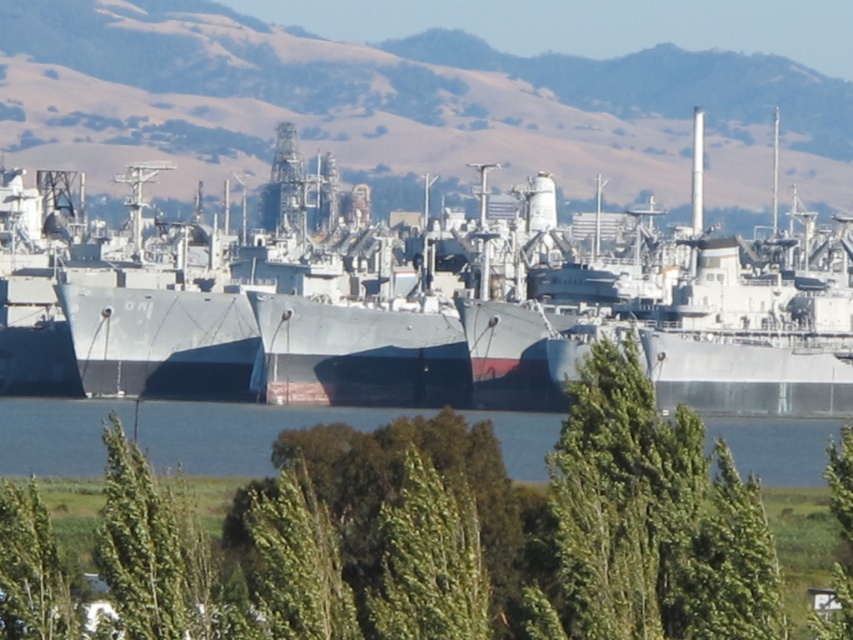
In the scene shown: Can you confirm if metallic gray ship at center is taller than blue water at center?

Indeed, metallic gray ship at center has a greater height compared to blue water at center.

Is point (802, 221) positioned in front of point (35, 467)?

No, (802, 221) is further to viewer.

The width and height of the screenshot is (853, 640). Find the location of `metallic gray ship at center`. metallic gray ship at center is located at coordinates (479, 320).

Who is positioned more to the right, green leafy tree at center or blue water at center?

green leafy tree at center

Which is more to the left, green leafy tree at center or blue water at center?

From the viewer's perspective, blue water at center appears more on the left side.

At what (x,y) coordinates should I click in order to perform the action: click on green leafy tree at center. Please return your answer as a coordinate pair (x, y). Looking at the image, I should click on (456, 532).

Who is positioned more to the right, green leafy tree at center or metallic gray ship at center?

Positioned to the right is metallic gray ship at center.

Describe the element at coordinates (456, 532) in the screenshot. I see `green leafy tree at center` at that location.

Is point (610, 381) more distant than point (250, 323)?

No, (610, 381) is in front of (250, 323).

At what (x,y) coordinates should I click in order to perform the action: click on green leafy tree at center. Please return your answer as a coordinate pair (x, y). This screenshot has width=853, height=640. Looking at the image, I should click on pyautogui.click(x=456, y=532).